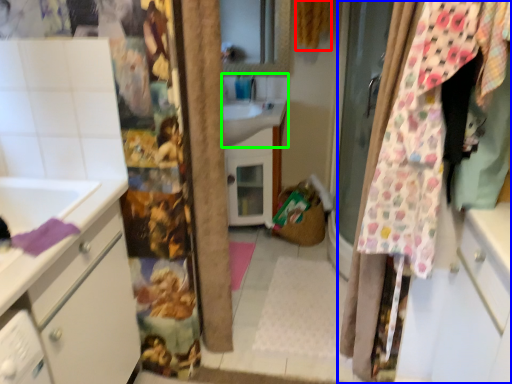
Question: Considering the real-world distances, which object is closest to curtain (highlighted by a red box)? curtain (highlighted by a blue box) or sink (highlighted by a green box).

Choices:
 (A) curtain
 (B) sink

Answer: (B)